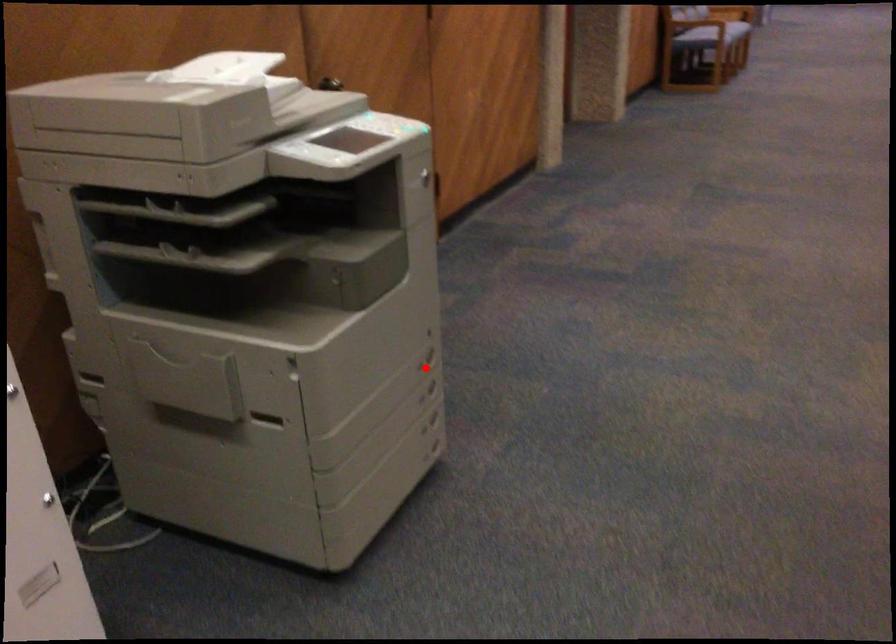
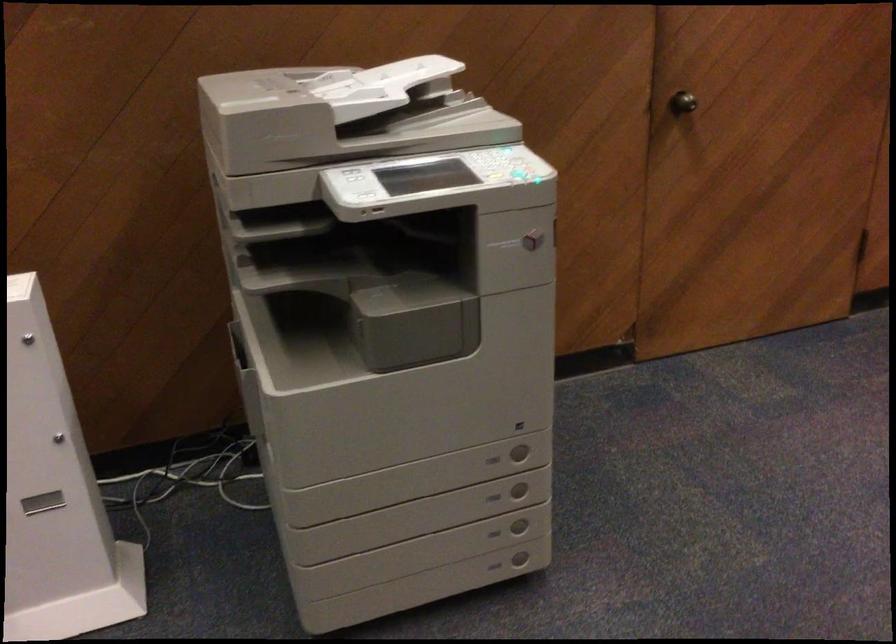
Question: I am providing you with two images of the same scene from different viewpoints. Given a red point in image1, look at the same physical point in image2. Is it:

Choices:
 (A) Closer to the viewpoint
 (B) Farther from the viewpoint

Answer: (A)